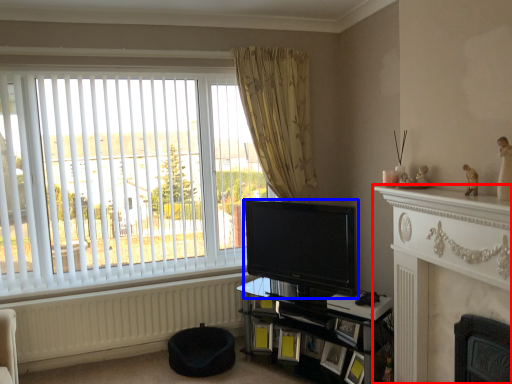
Question: Which of the following is the closest to the observer, fireplace (highlighted by a red box) or television (highlighted by a blue box)?

Choices:
 (A) fireplace
 (B) television

Answer: (A)